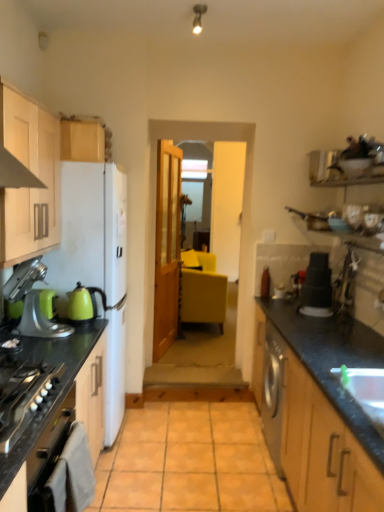
This screenshot has height=512, width=384. In order to click on free space above orange tile at center (from a real-world perspective) in this screenshot , I will do click(198, 443).